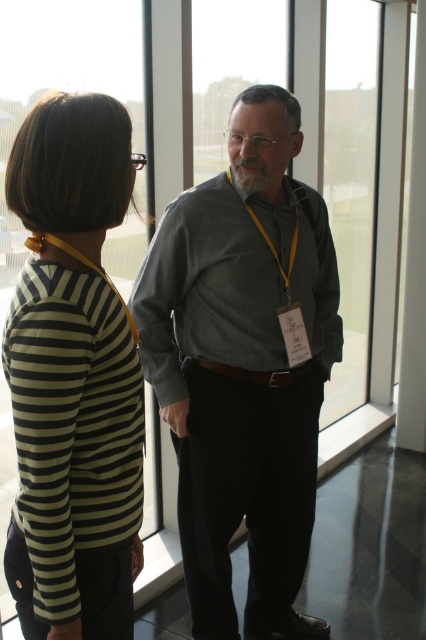
Question: Is striped fabric shirt at left closer to camera compared to gray cotton shirt at center?

Choices:
 (A) yes
 (B) no

Answer: (A)

Question: Which is farther from the gray matte shirt at center?

Choices:
 (A) gray cotton shirt at center
 (B) striped fabric shirt at left

Answer: (B)

Question: Can you confirm if gray matte shirt at center is positioned above gray cotton shirt at center?

Choices:
 (A) no
 (B) yes

Answer: (A)

Question: Among these points, which one is farthest from the camera?

Choices:
 (A) (310, 240)
 (B) (19, 198)
 (C) (293, 272)

Answer: (A)

Question: Does striped fabric shirt at left have a lesser width compared to gray cotton shirt at center?

Choices:
 (A) no
 (B) yes

Answer: (B)

Question: Which point is closer to the camera?

Choices:
 (A) (275, 396)
 (B) (181, 291)
 (C) (135, 509)

Answer: (C)